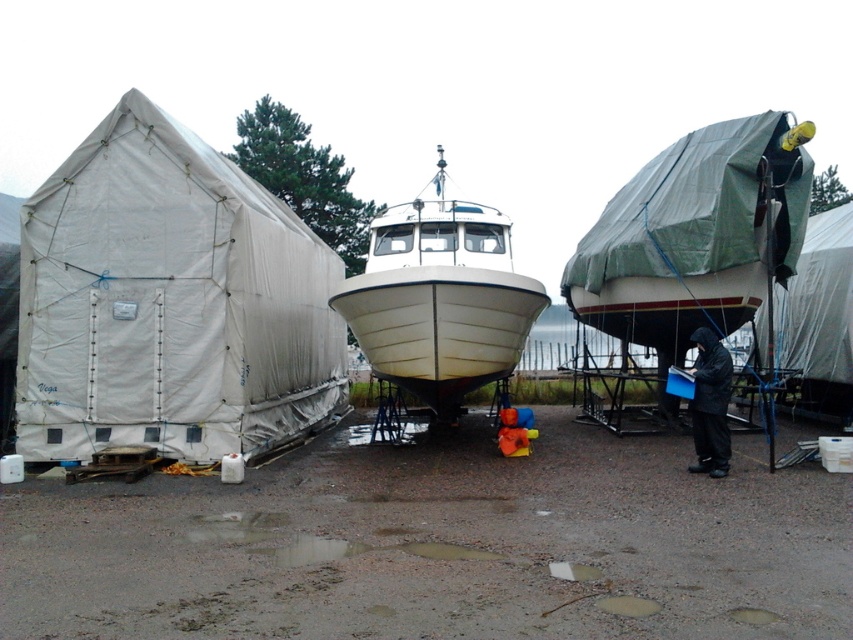
Which of these two, white fabric tent at left or black matte jacket at lower right, stands shorter?

With less height is black matte jacket at lower right.

Who is taller, white fabric tent at left or black matte jacket at lower right?

white fabric tent at left is taller.

Who is more forward, (296, 378) or (699, 461)?

Point (699, 461) is in front.

What are the coordinates of `white fabric tent at left` in the screenshot? It's located at (169, 301).

Does white fabric tent at left come behind white matte boat at center?

No, it is in front of white matte boat at center.

Can you confirm if white fabric tent at left is smaller than white matte boat at center?

Yes.

Locate an element on the screen. white fabric tent at left is located at coordinates (169, 301).

Where is `white fabric tent at left`? The height and width of the screenshot is (640, 853). white fabric tent at left is located at coordinates (169, 301).

Is point (160, 259) less distant than point (846, 372)?

Yes, it is.

Can you confirm if white fabric tent at left is thinner than green tarpaulin tent at center?

Incorrect, white fabric tent at left's width is not less than green tarpaulin tent at center's.

Is point (258, 205) farther from camera compared to point (840, 288)?

That is False.

You are a GUI agent. You are given a task and a screenshot of the screen. Output one action in this format:
    pyautogui.click(x=<x>, y=<y>)
    Task: Click on the white fabric tent at left
    The width and height of the screenshot is (853, 640).
    Given the screenshot: What is the action you would take?
    pyautogui.click(x=169, y=301)